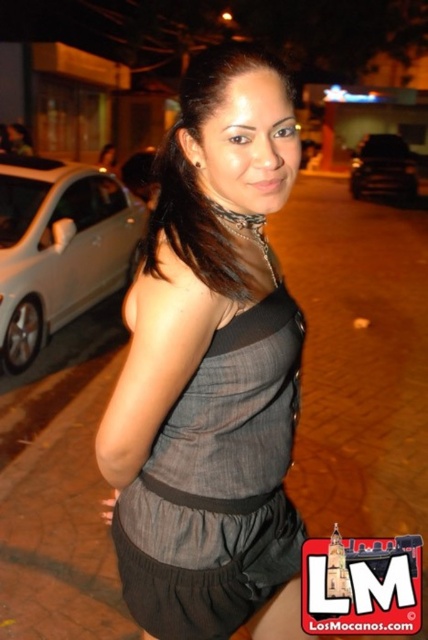
Question: Which point appears farthest from the camera in this image?

Choices:
 (A) (80, 579)
 (B) (222, 237)
 (C) (353, 173)
 (D) (210, 355)

Answer: (C)

Question: Can you confirm if brown brick pavement at center is positioned below matte black dress at center?

Choices:
 (A) no
 (B) yes

Answer: (A)

Question: Considering the real-world distances, which object is farthest from the black glossy car at right?

Choices:
 (A) white metallic car at left
 (B) matte black dress at center
 (C) matte gray dress at center

Answer: (B)

Question: Which of the following is the farthest from the observer?

Choices:
 (A) (162, 230)
 (B) (48, 268)
 (C) (335, 308)
 (D) (172, 179)

Answer: (C)

Question: Can you confirm if brown brick pavement at center is positioned to the left of matte black dress at center?

Choices:
 (A) no
 (B) yes

Answer: (A)

Question: Can you confirm if matte black dress at center is positioned to the right of black glossy car at right?

Choices:
 (A) no
 (B) yes

Answer: (A)